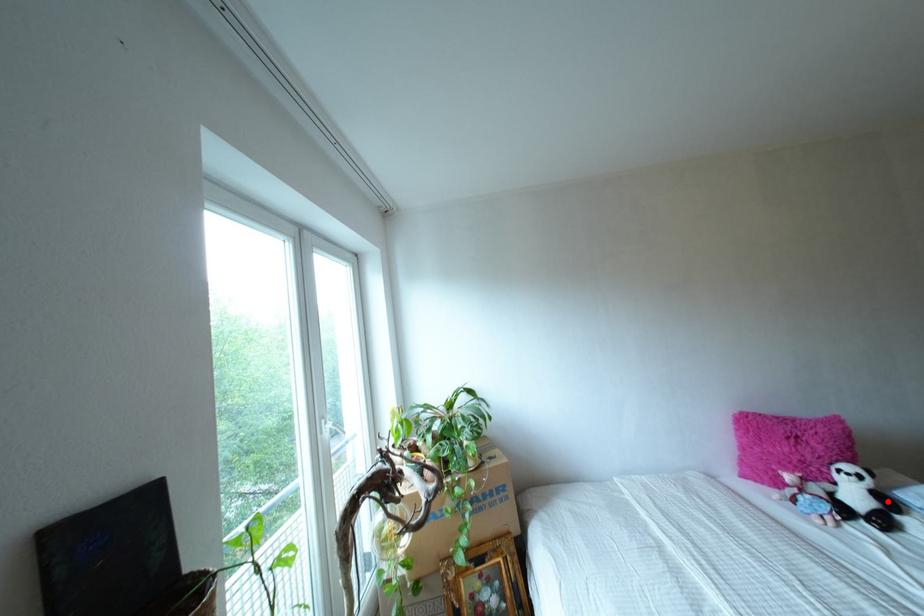
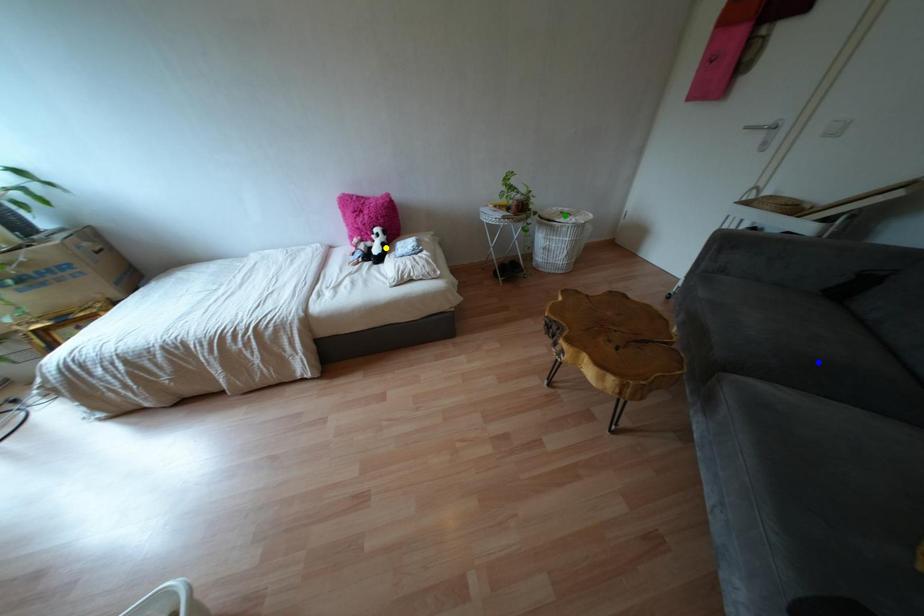
Question: I am providing you with two images of the same scene from different viewpoints. A red point is marked on the first image. You are given multiple points on the second image. Which point in image 2 is actually the same real-world point as the red point in image 1?

Choices:
 (A) blue point
 (B) green point
 (C) yellow point

Answer: (C)